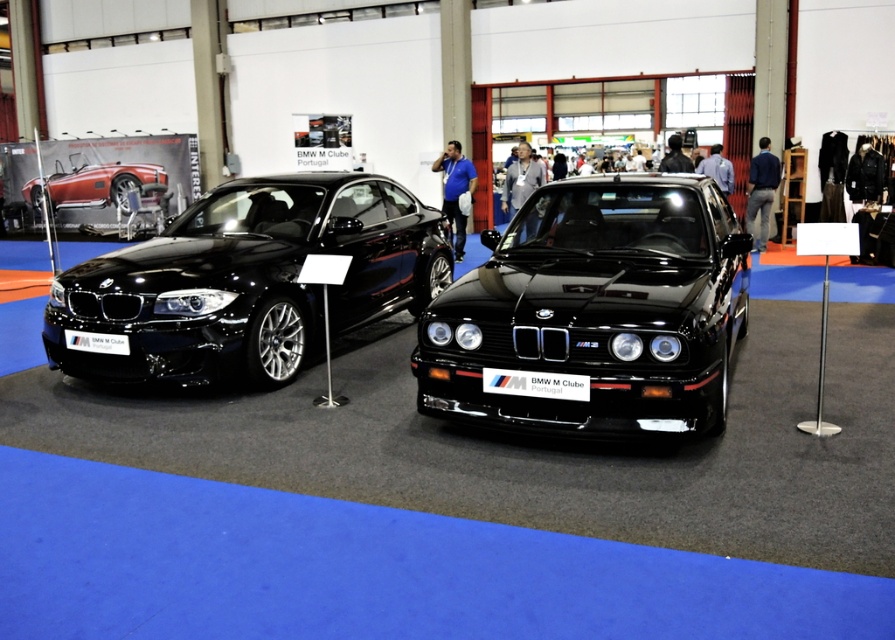
This screenshot has height=640, width=895. What are the coordinates of `glossy black car at center` in the screenshot? It's located at (595, 308).

Between point (609, 424) and point (75, 269), which one is positioned behind?

The point (75, 269) is behind.

Find the location of a particular element. glossy black car at center is located at coordinates (595, 308).

Who is shorter, matte black car at left or black plastic sign at center?

With less height is black plastic sign at center.

Is point (229, 230) in front of point (521, 381)?

No, (229, 230) is further to viewer.

The image size is (895, 640). Identify the location of matte black car at left. (250, 280).

Which is in front, point (65, 182) or point (78, 340)?

Point (78, 340) is more forward.

Which is in front, point (37, 209) or point (70, 346)?

Point (70, 346) is more forward.

Where is `metallic red car at left`? This screenshot has width=895, height=640. metallic red car at left is located at coordinates (101, 182).